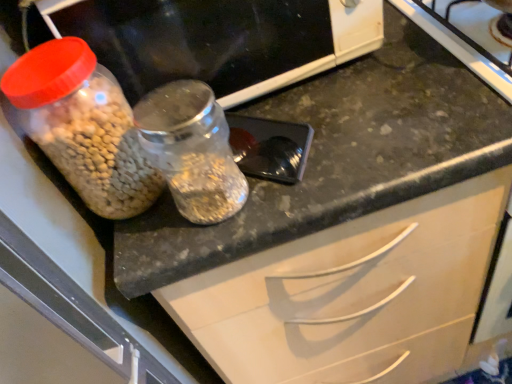
Describe the element at coordinates (192, 150) in the screenshot. I see `transparent glass jar at center` at that location.

This screenshot has width=512, height=384. Describe the element at coordinates (97, 147) in the screenshot. I see `translucent plastic jar at left` at that location.

The image size is (512, 384). Find the location of `transparent glass jar at center`. transparent glass jar at center is located at coordinates (192, 150).

Is translucent plastic jar at left a part of metallic black spoon at center?

That's incorrect, translucent plastic jar at left is not inside metallic black spoon at center.

Which object is closer to the camera taking this photo, metallic black spoon at center or translucent plastic jar at left?

Positioned in front is translucent plastic jar at left.

From the image's perspective, would you say metallic black spoon at center is positioned over translucent plastic jar at left?

No, from the image's perspective, metallic black spoon at center is not over translucent plastic jar at left.

The height and width of the screenshot is (384, 512). I want to click on appliance on the right side of translucent plastic jar at left, so click(x=270, y=147).

What are the coordinates of `glass jar located on the left of translucent plastic jar at left` in the screenshot? It's located at (192, 150).

How many degrees apart are the facing directions of transparent glass jar at center and translucent plastic jar at left?

There is a 0.351-degree angle between the facing directions of transparent glass jar at center and translucent plastic jar at left.

Does point (219, 109) lie in front of point (262, 6)?

No, (219, 109) is further to viewer.

Can you see transparent glass jar at center touching translucent plastic jar at left?

transparent glass jar at center is not next to translucent plastic jar at left, and they're not touching.

Consider the image. How different are the orientations of metallic black spoon at center and transparent glass jar at center in degrees?

There is a 55.6-degree angle between the facing directions of metallic black spoon at center and transparent glass jar at center.

Is metallic black spoon at center turned away from transparent glass jar at center?

No, metallic black spoon at center is not facing away from transparent glass jar at center.

Is metallic black spoon at center to the right of transparent glass jar at center from the viewer's perspective?

Indeed, metallic black spoon at center is positioned on the right side of transparent glass jar at center.

Between metallic black spoon at center and transparent glass jar at center, which one has more height?

transparent glass jar at center is taller.

Is translucent plastic jar at left next to metallic black spoon at center?

translucent plastic jar at left is not next to metallic black spoon at center, and they're not touching.

From a real-world perspective, is translucent plastic jar at left positioned under metallic black spoon at center based on gravity?

No, from a real-world perspective, translucent plastic jar at left is not below metallic black spoon at center.

From the image's perspective, is translucent plastic jar at left located beneath metallic black spoon at center?

No, from the image's perspective, translucent plastic jar at left is not beneath metallic black spoon at center.

Who is bigger, transparent glass jar at center or metallic black spoon at center?

Bigger between the two is transparent glass jar at center.

Does transparent glass jar at center lie in front of metallic black spoon at center?

That is True.

Would you say transparent glass jar at center is to the left or to the right of metallic black spoon at center in the picture?

Based on their positions, transparent glass jar at center is located to the left of metallic black spoon at center.

Choose the correct answer: Is translucent plastic jar at left inside translucent plastic jar at left or outside it?

translucent plastic jar at left is located beyond the bounds of translucent plastic jar at left.

Between translucent plastic jar at left and translucent plastic jar at left, which one has larger size?

With larger size is translucent plastic jar at left.

Considering the sizes of objects translucent plastic jar at left and translucent plastic jar at left in the image provided, who is wider, translucent plastic jar at left or translucent plastic jar at left?

translucent plastic jar at left is wider.

Is translucent plastic jar at left oriented away from translucent plastic jar at left?

That's not correct — translucent plastic jar at left is not looking away from translucent plastic jar at left.

Between translucent plastic jar at left and transparent glass jar at center, which one appears on the right side from the viewer's perspective?

Positioned to the right is translucent plastic jar at left.

Is translucent plastic jar at left turned away from transparent glass jar at center?

No, translucent plastic jar at left is not facing the opposite direction of transparent glass jar at center.

Which of these two, translucent plastic jar at left or transparent glass jar at center, is bigger?

translucent plastic jar at left.

The image size is (512, 384). Find the location of `glass jar in front of the translucent plastic jar at left`. glass jar in front of the translucent plastic jar at left is located at coordinates (192, 150).

Identify the location of wide above the metallic black spoon at center (from the image's perspective). This screenshot has width=512, height=384. (219, 40).

Identify the location of glass jar lying below the translucent plastic jar at left (from the image's perspective). (192, 150).

From the image, which object appears to be nearer to translucent plastic jar at left, metallic black spoon at center or transparent glass jar at center?

Among the two, metallic black spoon at center is located nearer to translucent plastic jar at left.

Which object lies nearer to the anchor point translucent plastic jar at left, transparent glass jar at center or translucent plastic jar at left?

Among the two, transparent glass jar at center is located nearer to translucent plastic jar at left.

Looking at the image, which one is located further to translucent plastic jar at left, metallic black spoon at center or translucent plastic jar at left?

translucent plastic jar at left is positioned further to the anchor translucent plastic jar at left.

Estimate the real-world distances between objects in this image. Which object is further from translucent plastic jar at left, translucent plastic jar at left or metallic black spoon at center?

translucent plastic jar at left is further to translucent plastic jar at left.

Looking at the image, which one is located further to translucent plastic jar at left, translucent plastic jar at left or transparent glass jar at center?

Among the two, translucent plastic jar at left is located further to translucent plastic jar at left.

Considering their positions, is transparent glass jar at center positioned closer to translucent plastic jar at left than translucent plastic jar at left?

Among the two, transparent glass jar at center is located nearer to translucent plastic jar at left.

When comparing their distances from metallic black spoon at center, does translucent plastic jar at left or translucent plastic jar at left seem further?

Based on the image, translucent plastic jar at left appears to be further to metallic black spoon at center.

When comparing their distances from transparent glass jar at center, does translucent plastic jar at left or translucent plastic jar at left seem further?

translucent plastic jar at left is further to transparent glass jar at center.

You are a GUI agent. You are given a task and a screenshot of the screen. Output one action in this format:
    pyautogui.click(x=<x>, y=<y>)
    Task: Click on the appliance between translucent plastic jar at left and transparent glass jar at center from top to bottom
    Image resolution: width=512 pixels, height=384 pixels.
    Given the screenshot: What is the action you would take?
    pyautogui.click(x=270, y=147)

Where is `food between translucent plastic jar at left and transparent glass jar at center in the up-down direction`? This screenshot has width=512, height=384. food between translucent plastic jar at left and transparent glass jar at center in the up-down direction is located at coordinates (97, 147).

The width and height of the screenshot is (512, 384). I want to click on glass jar located between translucent plastic jar at left and metallic black spoon at center in the left-right direction, so tap(192, 150).

Where is `food between translucent plastic jar at left and metallic black spoon at center vertically`? food between translucent plastic jar at left and metallic black spoon at center vertically is located at coordinates (97, 147).